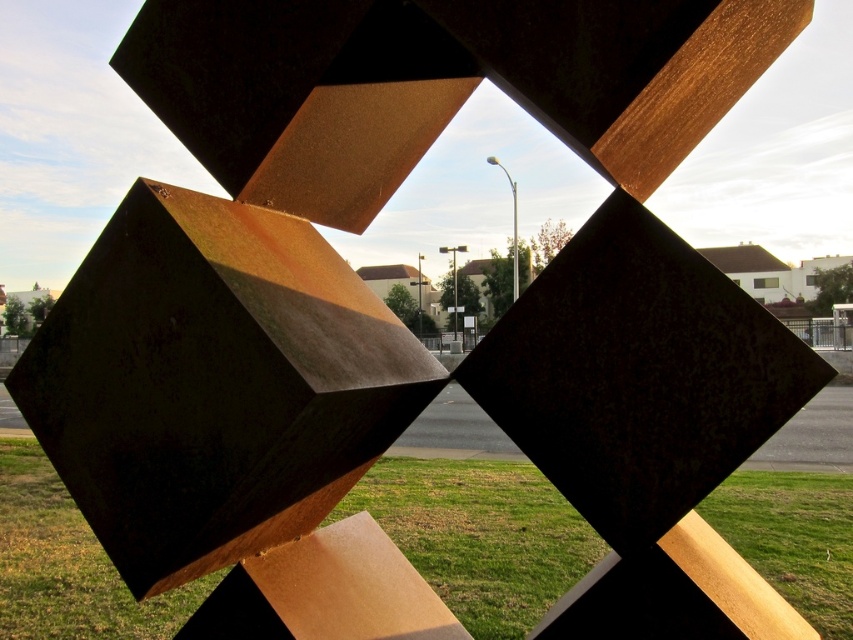
This screenshot has height=640, width=853. Describe the element at coordinates (822, 332) in the screenshot. I see `rusty metal fence at lower right` at that location.

Does rusty metal fence at lower right come in front of rusty metal fence at center?

Yes, rusty metal fence at lower right is in front of rusty metal fence at center.

Who is more distant from viewer, [850,337] or [428,332]?

The point [428,332] is behind.

At what (x,y) coordinates should I click in order to perform the action: click on rusty metal fence at lower right. Please return your answer as a coordinate pair (x, y). Looking at the image, I should click on (822, 332).

Is green grass at lower center thinner than rusty metal fence at lower left?

In fact, green grass at lower center might be wider than rusty metal fence at lower left.

Is point (38, 508) positioned after point (0, 339)?

No.

Locate an element on the screen. green grass at lower center is located at coordinates (480, 536).

Who is positioned more to the right, rusty metal fence at lower right or rusty metal fence at lower left?

Positioned to the right is rusty metal fence at lower right.

Is rusty metal fence at lower right below rusty metal fence at lower left?

No, rusty metal fence at lower right is not below rusty metal fence at lower left.

At what (x,y) coordinates should I click in order to perform the action: click on rusty metal fence at lower right. Please return your answer as a coordinate pair (x, y). The height and width of the screenshot is (640, 853). Looking at the image, I should click on (822, 332).